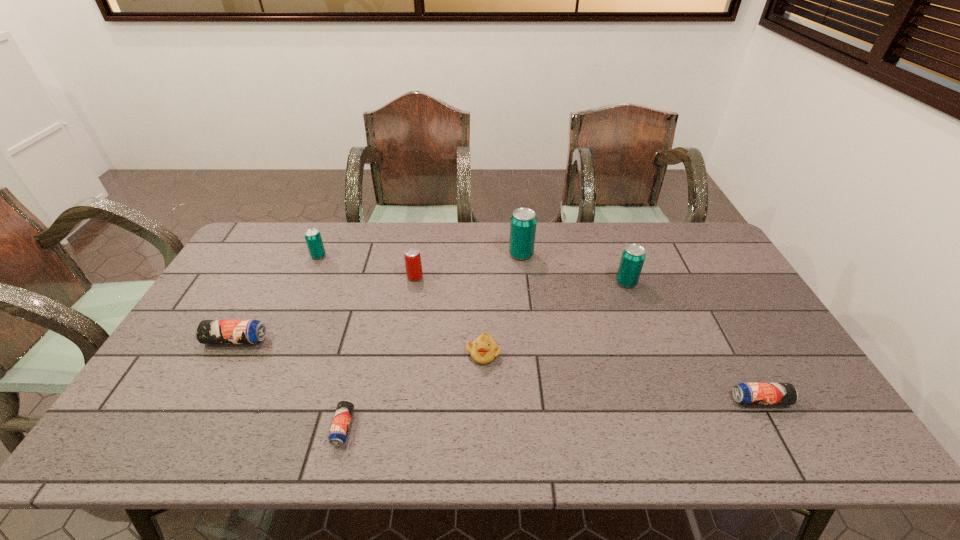
What are the coordinates of `vacant space positioned 0.190m on the front-facing side of the duckling` in the screenshot? It's located at (484, 433).

I want to click on free location located on the back of the leftmost blue beer can, so click(x=269, y=280).

The width and height of the screenshot is (960, 540). Find the location of `vacant region located 0.270m on the back of the second biggest blue beer can`. vacant region located 0.270m on the back of the second biggest blue beer can is located at coordinates (712, 313).

At what (x,y) coordinates should I click in order to perform the action: click on vacant space situated 0.150m on the back of the shortest object. Please return your answer as a coordinate pair (x, y). This screenshot has width=960, height=540. Looking at the image, I should click on (x=361, y=359).

Locate an element on the screen. object located in the near edge section of the desktop is located at coordinates (339, 429).

Locate an element on the screen. This screenshot has width=960, height=540. object at the left edge is located at coordinates [208, 331].

You are a GUI agent. You are given a task and a screenshot of the screen. Output one action in this format:
    pyautogui.click(x=<x>, y=<y>)
    Task: Click on the object located in the right edge section of the desktop
    
    Given the screenshot: What is the action you would take?
    pyautogui.click(x=745, y=393)

Find the location of a particular element. The height and width of the screenshot is (540, 960). free space at the far edge of the desktop is located at coordinates (581, 261).

Locate an element on the screen. The image size is (960, 540). free space at the near edge of the desktop is located at coordinates (527, 439).

The width and height of the screenshot is (960, 540). Identify the location of free spot at the left edge of the desktop. (264, 296).